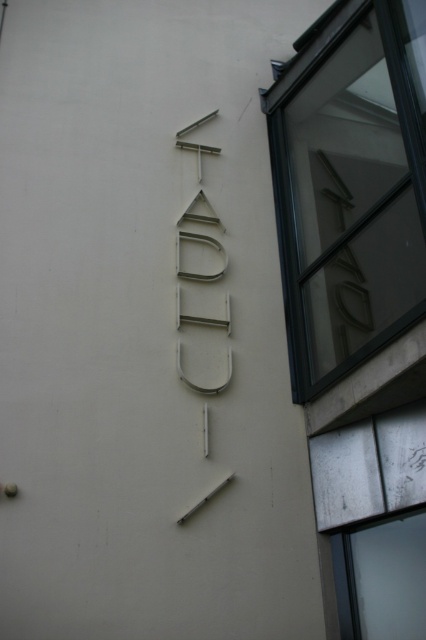
You are a delivery person trying to locate the entrance to the building. You see the black glass window at upper right and the metallic silver sign at center. Which object is larger and could help you identify the main entrance?

The black glass window at upper right is bigger than the metallic silver sign at center, so the window is larger and could help identify the main entrance.

You are a delivery person trying to place a package on the ground near the metallic silver sign at center. The package must be placed exactly 4 feet away from the black glass window at upper right. Can you place the package in the correct position?

The distance between the black glass window at upper right and the metallic silver sign at center is 4.06 feet. Since the required distance is 4 feet, placing the package at the base of the metallic silver sign at center would meet the requirement as it is very close to the needed distance.

You are a delivery person trying to find the entrance to the building. You see the black glass window at upper right and the metallic silver sign at center. Which object is positioned higher on the wall?

The black glass window at upper right is located above the metallic silver sign at center, so it is positioned higher on the wall.